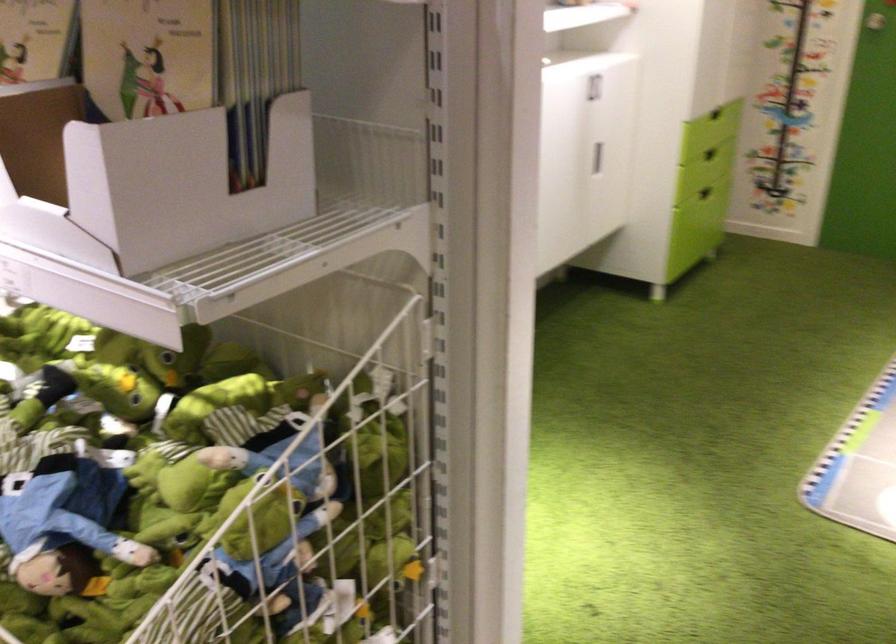
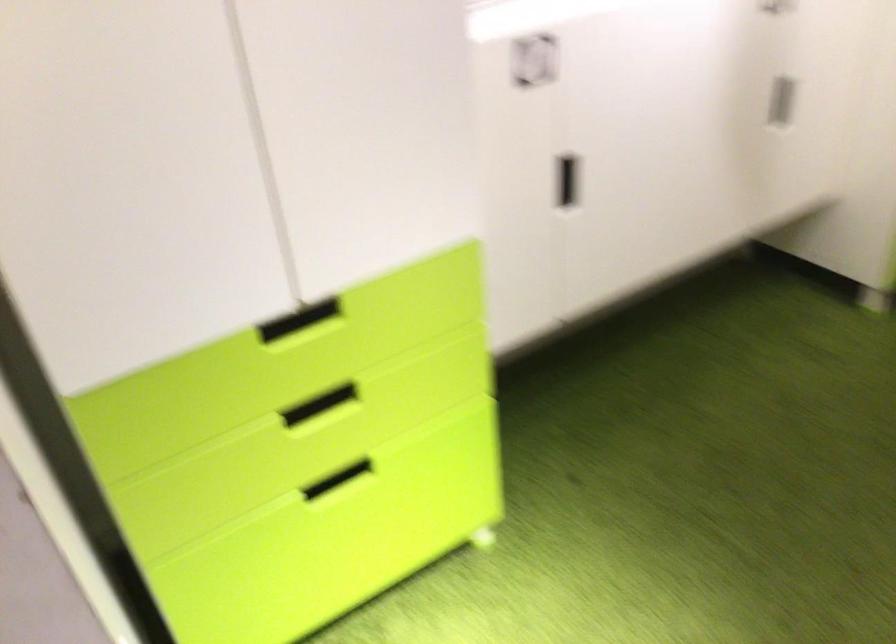
Question: The images are taken continuously from a first-person perspective. In which direction is your viewpoint rotating?

Choices:
 (A) Left
 (B) Right
 (C) Up
 (D) Down

Answer: (A)